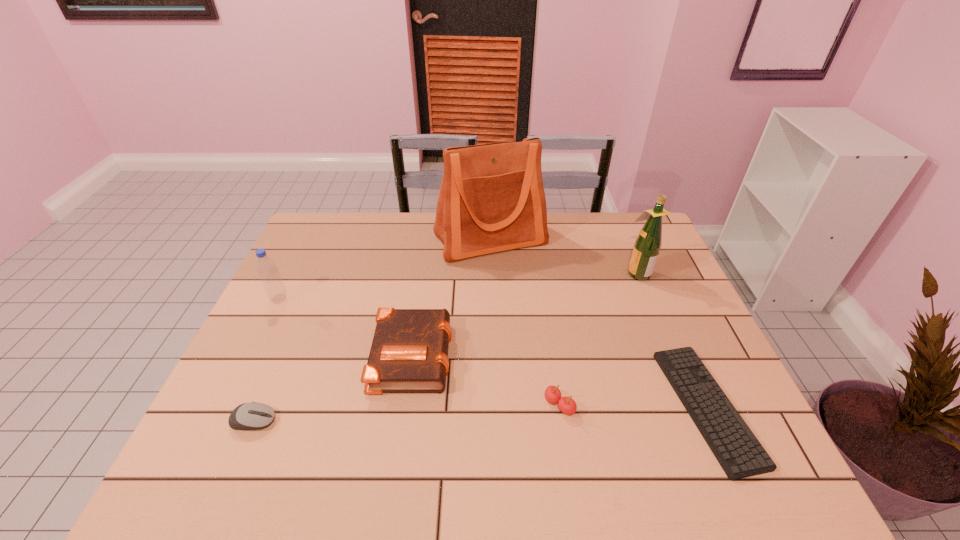
Identify the location of vacant space situated on the front-facing side of the second tallest object. The image size is (960, 540). (602, 272).

Where is `free space located 0.260m on the front-facing side of the second tallest object`? Image resolution: width=960 pixels, height=540 pixels. free space located 0.260m on the front-facing side of the second tallest object is located at coordinates (542, 272).

The image size is (960, 540). Find the location of `free region located 0.360m on the front-facing side of the second tallest object`. free region located 0.360m on the front-facing side of the second tallest object is located at coordinates (511, 272).

I want to click on vacant region located 0.070m on the right of the fifth shortest object, so click(311, 299).

Where is `vacant space located 0.260m on the spine side of the Bible`? Image resolution: width=960 pixels, height=540 pixels. vacant space located 0.260m on the spine side of the Bible is located at coordinates (551, 353).

This screenshot has height=540, width=960. I want to click on free location located 0.260m on the left of the cherry, so click(434, 405).

Where is `vacant space located 0.160m on the wheel side of the sixth tallest object`? The width and height of the screenshot is (960, 540). vacant space located 0.160m on the wheel side of the sixth tallest object is located at coordinates (347, 421).

Locate an element on the screen. free space located on the back of the shortest object is located at coordinates (643, 261).

The image size is (960, 540). I want to click on object situated at the far edge, so click(492, 199).

Where is `object located in the near edge section of the desktop`? This screenshot has width=960, height=540. object located in the near edge section of the desktop is located at coordinates (738, 451).